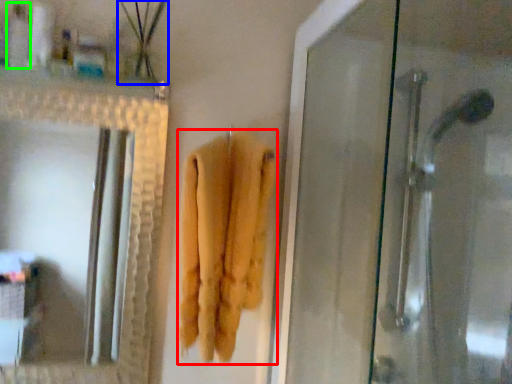
Question: Based on their relative distances, which object is nearer to towel (highlighted by a red box)? Choose from plant (highlighted by a blue box) and toiletry (highlighted by a green box).

Choices:
 (A) plant
 (B) toiletry

Answer: (A)